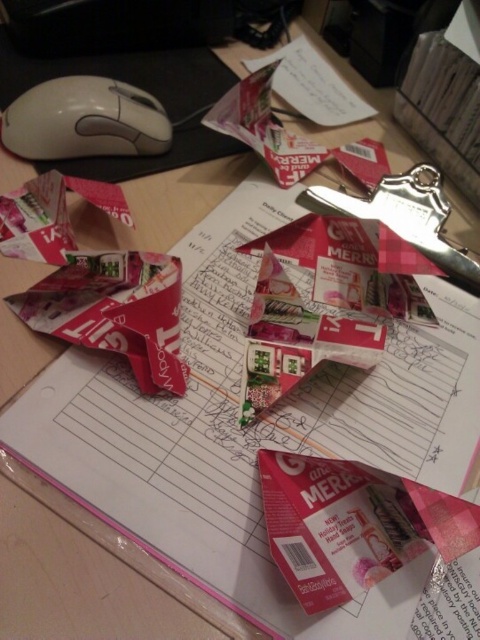
You are standing 30 inches away from the desk. Is the point at coordinates point (37, 157) on the desk surface within your reach?

The point at coordinates point (37, 157) is 34.67 inches away from the camera. Since you are standing 30 inches away from the desk, the point is 4.67 inches out of reach.

You are looking at the desk scene. There are two points marked on the desk surface at coordinates point (117, 125) and point (312, 88). Which of these points is closer to you?

Point (117, 125) is closer to the viewer than point (312, 88).